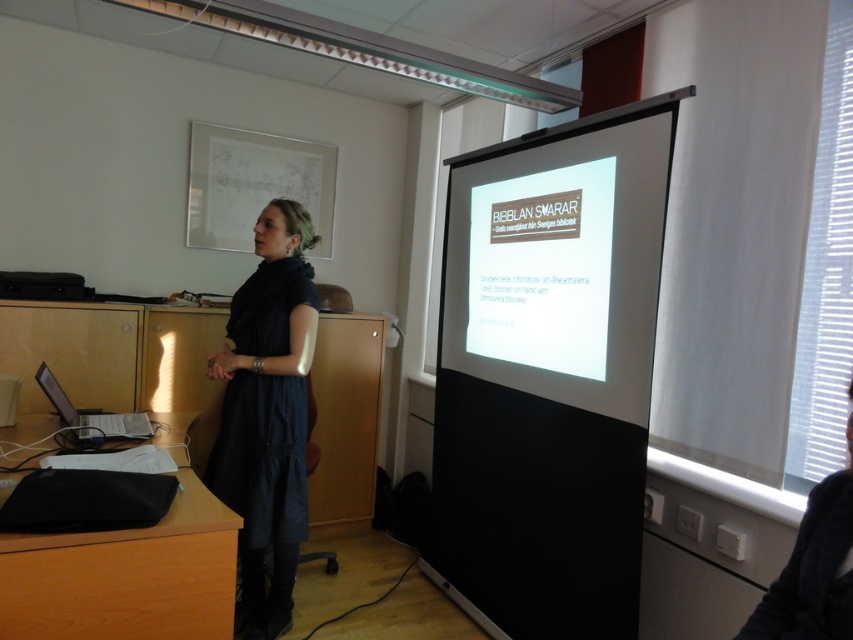
Is white glossy projection screen at center positioned at the back of dark gray sweater at lower right?

Yes, it is.

Is white glossy projection screen at center taller than dark gray sweater at lower right?

Yes.

This screenshot has height=640, width=853. Describe the element at coordinates (561, 259) in the screenshot. I see `white glossy projection screen at center` at that location.

In order to click on white glossy projection screen at center in this screenshot , I will do `click(561, 259)`.

Does white glossy projection screen at center have a greater width compared to matte black laptop at left?

Yes, white glossy projection screen at center is wider than matte black laptop at left.

Is point (511, 346) farther from camera compared to point (149, 433)?

Yes, it is.

Find the location of a particular element. This screenshot has width=853, height=640. white glossy projection screen at center is located at coordinates (561, 259).

In the scene shown: Is the position of dark gray sweater at lower right less distant than that of matte black laptop at left?

Yes, dark gray sweater at lower right is closer to the viewer.

Who is taller, dark gray sweater at lower right or matte black laptop at left?

dark gray sweater at lower right

Identify the location of dark gray sweater at lower right. This screenshot has width=853, height=640. (813, 570).